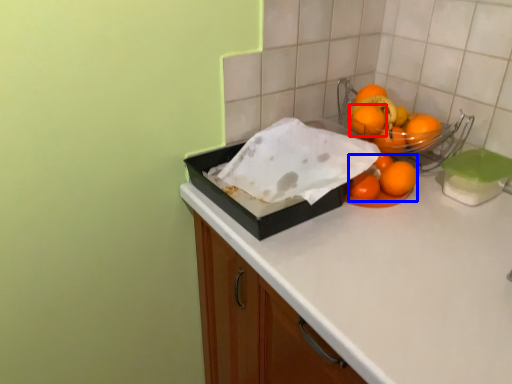
Question: Which point is closer to the camera, orange (highlighted by a red box) or orange (highlighted by a blue box)?

Choices:
 (A) orange
 (B) orange

Answer: (B)